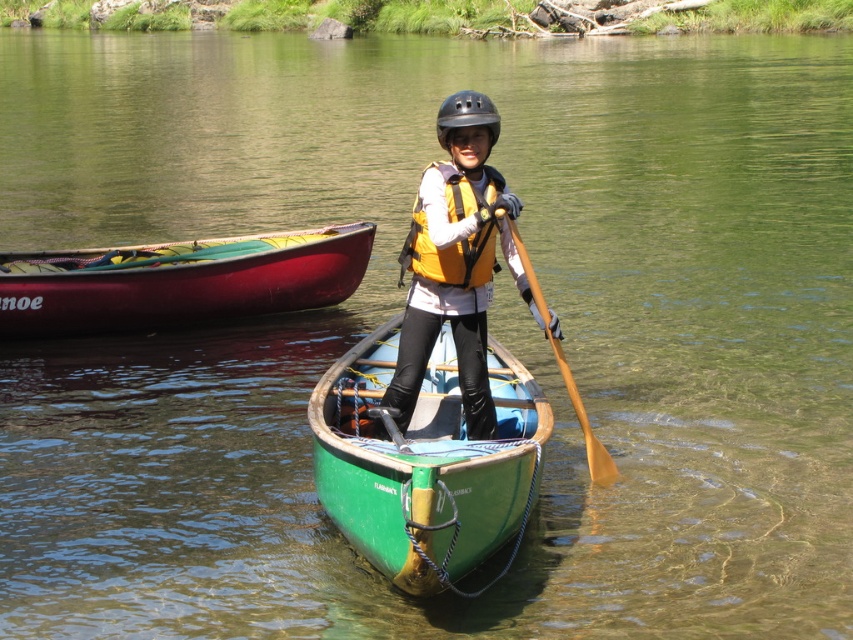
Question: Which of the following is the closest to the observer?

Choices:
 (A) yellow life vest at center
 (B) green polished wood canoe at center
 (C) yellow matte life jacket at center

Answer: (B)

Question: Is the position of green polished wood canoe at center more distant than that of black matte helmet at center?

Choices:
 (A) no
 (B) yes

Answer: (A)

Question: Observing the image, what is the correct spatial positioning of red glossy canoe at upper left in reference to yellow life vest at center?

Choices:
 (A) left
 (B) right

Answer: (A)

Question: Which of the following is the closest to the observer?

Choices:
 (A) [x=517, y=474]
 (B) [x=590, y=436]

Answer: (A)

Question: Which point is farther to the camera?

Choices:
 (A) wooden paddle at center
 (B) green polished wood canoe at center
 (C) yellow life vest at center

Answer: (C)

Question: Is yellow matte life jacket at center below black matte helmet at center?

Choices:
 (A) yes
 (B) no

Answer: (A)